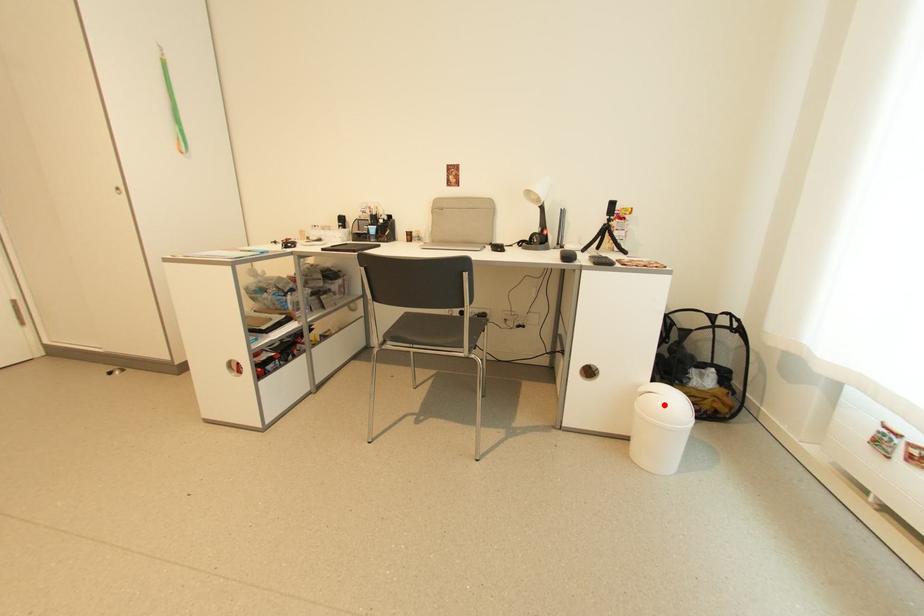
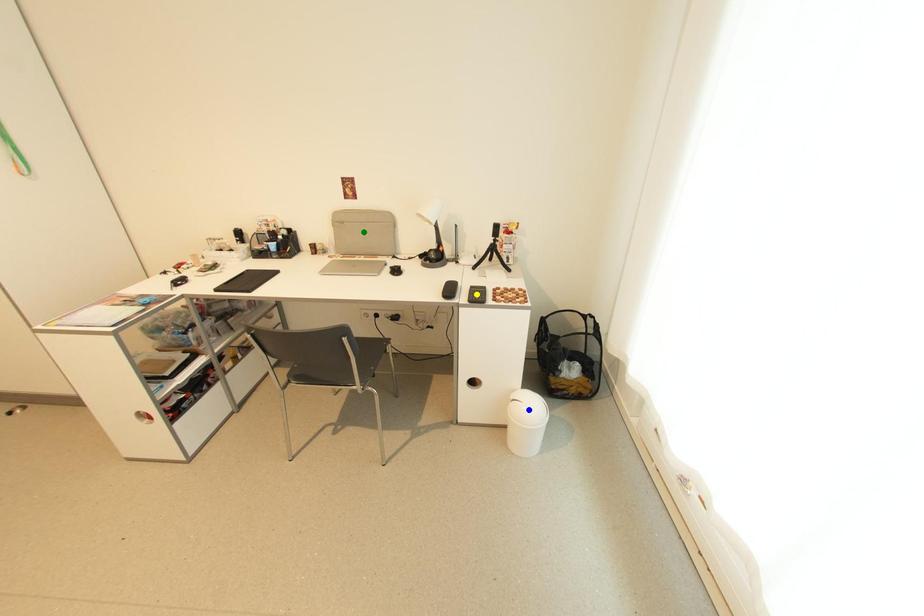
Question: I am providing you with two images of the same scene from different viewpoints. A red point is marked on the first image. You are given multiple points on the second image. Can you choose the point in image 2 that corresponds to the point in image 1?

Choices:
 (A) green point
 (B) yellow point
 (C) blue point

Answer: (C)